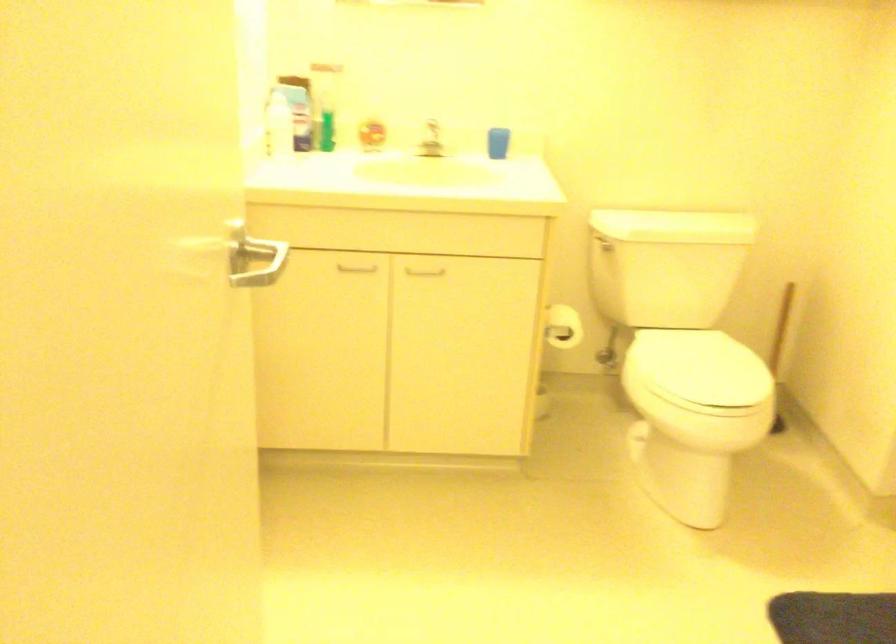
This screenshot has width=896, height=644. Describe the element at coordinates (431, 140) in the screenshot. I see `a faucet handle` at that location.